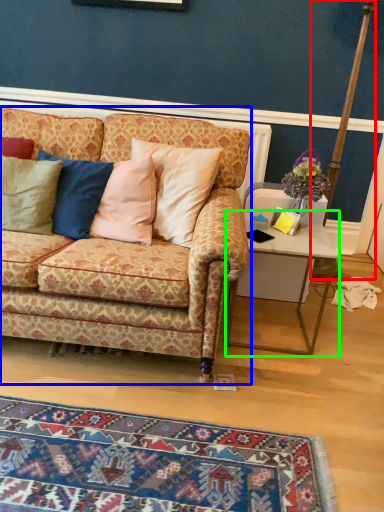
Question: Based on their relative distances, which object is farther from pole (highlighted by a red box)? Choose from studio couch (highlighted by a blue box) and desk (highlighted by a green box).

Choices:
 (A) studio couch
 (B) desk

Answer: (A)